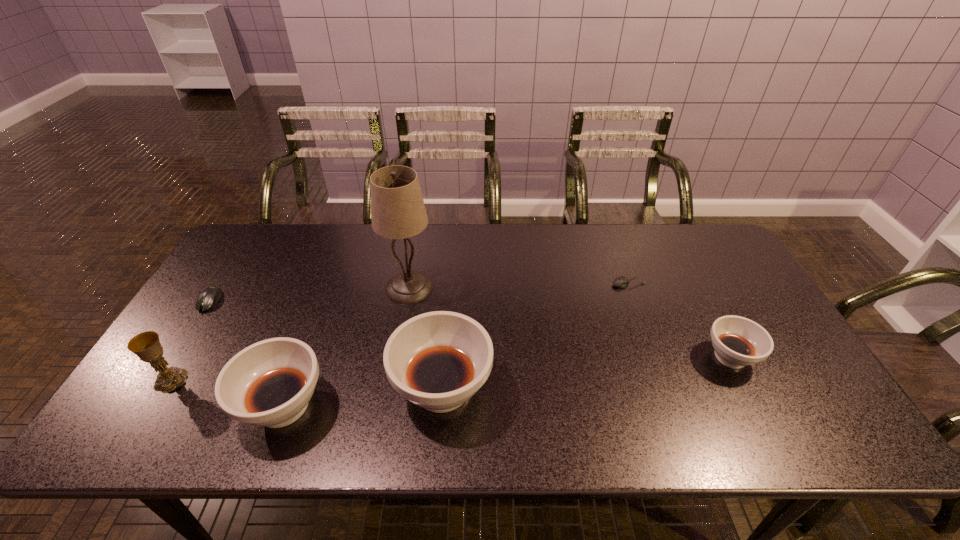
Find the location of `chalice present at the left edge`. chalice present at the left edge is located at coordinates (146, 345).

Locate an element on the screen. object that is at the right edge is located at coordinates (738, 342).

Identify the location of object that is at the near left corner. (146, 345).

At what (x,y) coordinates should I click in order to perform the action: click on object present at the near right corner. Please return your answer as a coordinate pair (x, y). The height and width of the screenshot is (540, 960). Looking at the image, I should click on (738, 342).

Find the location of a particular element. The height and width of the screenshot is (540, 960). vacant region at the far edge is located at coordinates (508, 260).

Where is `free space at the near edge`? The image size is (960, 540). free space at the near edge is located at coordinates (366, 383).

You are a GUI agent. You are given a task and a screenshot of the screen. Output one action in this format:
    pyautogui.click(x=<x>, y=<y>)
    Task: Click on the blank space at the left edge of the desktop
    The width and height of the screenshot is (960, 540).
    Given the screenshot: What is the action you would take?
    pyautogui.click(x=182, y=342)

Locate an element on the screen. free space at the right edge of the desktop is located at coordinates (736, 301).

Image resolution: width=960 pixels, height=540 pixels. I want to click on free space at the far left corner of the desktop, so click(x=256, y=238).

The width and height of the screenshot is (960, 540). I want to click on vacant space at the far right corner of the desktop, so click(730, 267).